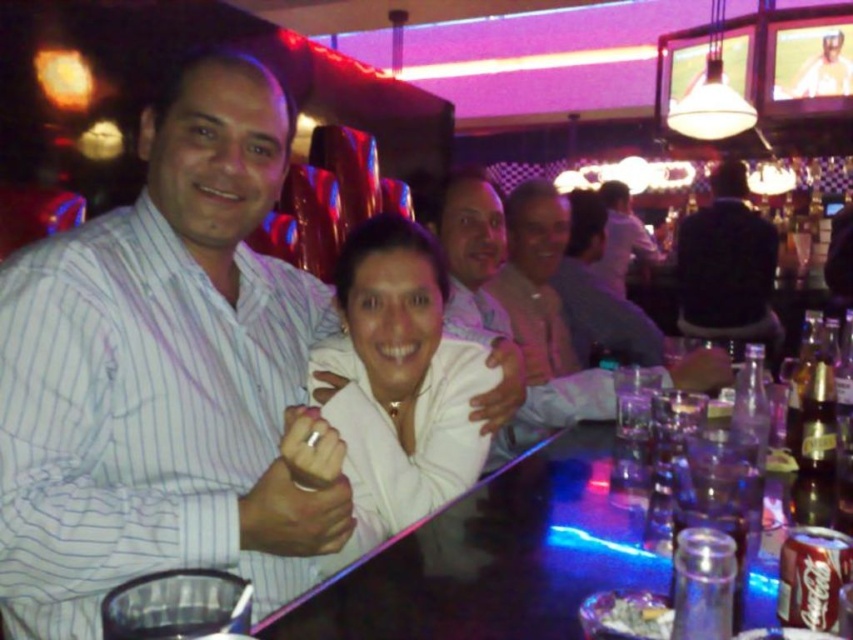
You are a bartender who needs to reach the clear glass bottle at bar to prepare a drink. However, there is a customer wearing a black fabric shirt at right in your way. Based on the scene, can you easily access the bottle without disturbing the customer?

The black fabric shirt at right is above clear glass bottle at bar, so the customer is not blocking the bottle. You can easily access the clear glass bottle at bar without disturbing the customer.

You are a photographer at the event and want to capture both the white striped shirt at center and the white shirt at center in the same photo. Which one should you focus on first to ensure both are in frame?

You should focus on the white shirt at center first since it is above the white striped shirt at center, ensuring both are within the frame.